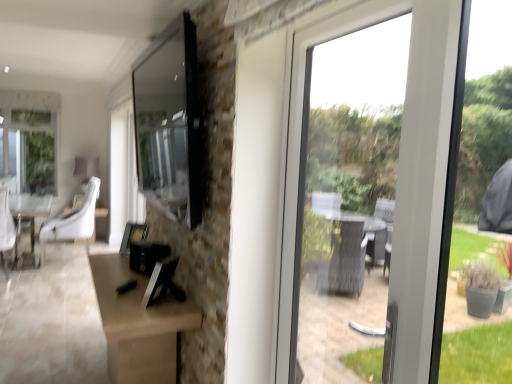
Where is `blank area beneath white fabric chair at center (from a real-world perspective)`? Image resolution: width=512 pixels, height=384 pixels. blank area beneath white fabric chair at center (from a real-world perspective) is located at coordinates (63, 262).